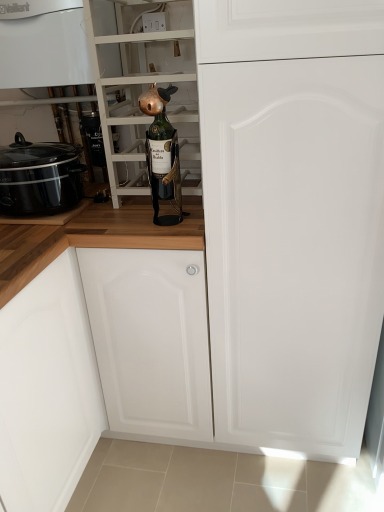
Where is `free space that is to the left of green glass bottle at center`? This screenshot has height=512, width=384. free space that is to the left of green glass bottle at center is located at coordinates (116, 222).